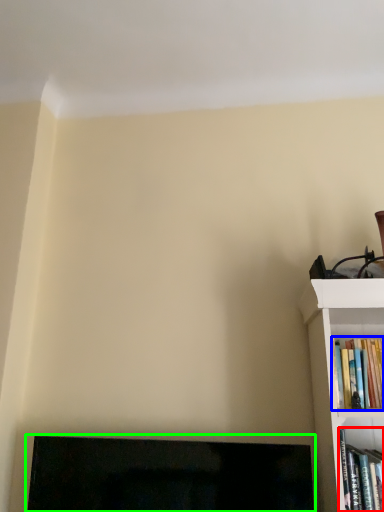
Question: Which is nearer to the book (highlighted by a red box)? book (highlighted by a blue box) or fireplace (highlighted by a green box).

Choices:
 (A) book
 (B) fireplace

Answer: (A)